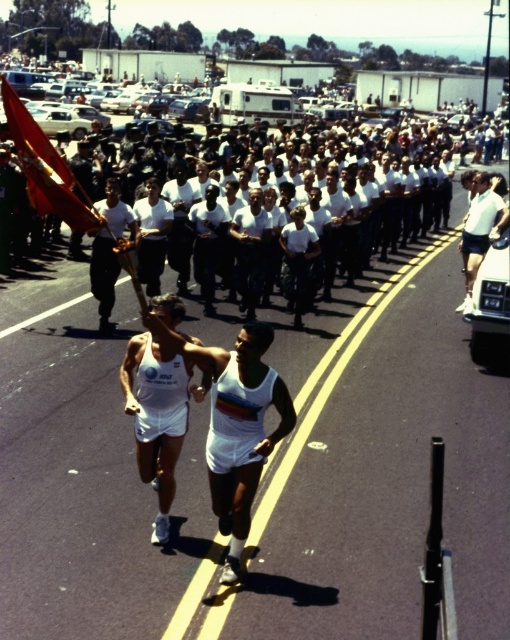
Question: Can you confirm if white matte singlet at center is smaller than white matte shorts at center?

Choices:
 (A) no
 (B) yes

Answer: (B)

Question: Observing the image, what is the correct spatial positioning of white uniform at center in reference to white matte shorts at center?

Choices:
 (A) left
 (B) right

Answer: (A)

Question: Which point is farther to the camera?

Choices:
 (A) white uniform at center
 (B) red fabric flag at upper left
 (C) white fabric tank top at center

Answer: (B)

Question: Among these objects, which one is farthest from the camera?

Choices:
 (A) white fabric tank top at center
 (B) white matte shorts at center

Answer: (B)

Question: From the image, what is the correct spatial relationship of red fabric flag at upper left in relation to white uniform at center?

Choices:
 (A) below
 (B) above

Answer: (B)

Question: Estimate the real-world distances between objects in this image. Which object is farther from the white matte singlet at center?

Choices:
 (A) white fabric tank top at center
 (B) red fabric flag at upper left

Answer: (B)